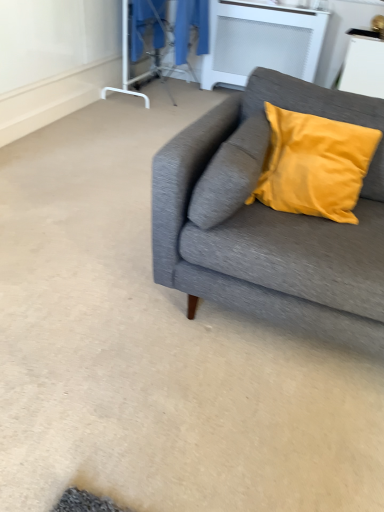
You are a GUI agent. You are given a task and a screenshot of the screen. Output one action in this format:
    pyautogui.click(x=<x>, y=<y>)
    Task: Click on the transparent plastic screen door at upper center
    The width and height of the screenshot is (384, 512).
    Given the screenshot: What is the action you would take?
    tap(143, 21)

Locate an element on the screen. white matte radiator at upper center, the 1th table from the back is located at coordinates (261, 42).

I want to click on textured gray couch at right, so click(x=274, y=224).

You are a GUI agent. You are given a task and a screenshot of the screen. Output one action in this format:
    pyautogui.click(x=<x>, y=<y>)
    Task: Click on the white glossy table at upper right, arranged as the 1th table when viewed from the front
    
    Given the screenshot: What is the action you would take?
    pyautogui.click(x=363, y=65)

I want to click on transparent plastic screen door at upper center, so 143,21.

Is transparent plastic screen door at upper center further to camera compared to textured gray couch at right?

Yes, it is behind textured gray couch at right.

Looking at their sizes, would you say transparent plastic screen door at upper center is wider or thinner than textured gray couch at right?

Considering their sizes, transparent plastic screen door at upper center looks slimmer than textured gray couch at right.

Could you tell me if transparent plastic screen door at upper center is turned towards textured gray couch at right?

No, transparent plastic screen door at upper center is not facing towards textured gray couch at right.

Does transparent plastic screen door at upper center have a greater height compared to textured gray couch at right?

No.

In the image, is white matte radiator at upper center, which is the 2th table from front to back, positioned in front of or behind transparent plastic screen door at upper center?

Clearly, white matte radiator at upper center, which is the 2th table from front to back, is behind transparent plastic screen door at upper center.

Locate an element on the screen. This screenshot has height=512, width=384. screen door located in front of the white matte radiator at upper center, which is the 2th table from front to back is located at coordinates (143, 21).

Visually, is white matte radiator at upper center, which appears as the second table when viewed from the right, positioned to the left or to the right of transparent plastic screen door at upper center?

Clearly, white matte radiator at upper center, which appears as the second table when viewed from the right, is on the right of transparent plastic screen door at upper center in the image.

Is white matte radiator at upper center, the 1th table from the back, taller than transparent plastic screen door at upper center?

Correct, white matte radiator at upper center, the 1th table from the back, is much taller as transparent plastic screen door at upper center.

Locate an element on the screen. The height and width of the screenshot is (512, 384). laundry on the left of white glossy table at upper right, positioned as the second table in left-to-right order is located at coordinates (189, 28).

From the image's perspective, which is above, white glossy table at upper right, positioned as the second table in left-to-right order, or blue fabric laundry at upper center?

From the image's view, blue fabric laundry at upper center is above.

Consider the image. Who is more distant, white glossy table at upper right, positioned as the second table in left-to-right order, or blue fabric laundry at upper center?

blue fabric laundry at upper center.

Could you measure the distance between white glossy table at upper right, positioned as the second table in left-to-right order, and blue fabric laundry at upper center?

1.42 meters.

From the image's perspective, is blue fabric laundry at upper center on top of transparent plastic screen door at upper center?

No, from the image's perspective, blue fabric laundry at upper center is not over transparent plastic screen door at upper center.

The width and height of the screenshot is (384, 512). I want to click on laundry on the right of transparent plastic screen door at upper center, so click(189, 28).

How much distance is there between blue fabric laundry at upper center and transparent plastic screen door at upper center?

blue fabric laundry at upper center is 25.71 inches away from transparent plastic screen door at upper center.

Is point (180, 23) positioned before point (127, 8)?

Yes, it is.

Considering the points (309, 309) and (149, 2), which point is in front, point (309, 309) or point (149, 2)?

The point (309, 309) is more forward.

Are textured gray couch at right and transparent plastic screen door at upper center beside each other?

No, textured gray couch at right is not next to transparent plastic screen door at upper center.

Is textured gray couch at right located outside transparent plastic screen door at upper center?

Yes, textured gray couch at right is not within transparent plastic screen door at upper center.

Is white glossy table at upper right, positioned as the second table in left-to-right order, at the back of textured gray couch at right?

Yes, textured gray couch at right is positioned with its back facing white glossy table at upper right, positioned as the second table in left-to-right order.

From the image's perspective, between textured gray couch at right and white glossy table at upper right, positioned as the second table in left-to-right order, who is located below?

textured gray couch at right is shown below in the image.

Considering the relative sizes of textured gray couch at right and white glossy table at upper right, arranged as the 1th table when viewed from the front, in the image provided, is textured gray couch at right bigger than white glossy table at upper right, arranged as the 1th table when viewed from the front,?

Yes, textured gray couch at right is bigger than white glossy table at upper right, arranged as the 1th table when viewed from the front.

Is the surface of textured gray couch at right in direct contact with white glossy table at upper right, which appears as the 2th table when viewed from the back?

No, textured gray couch at right is not with white glossy table at upper right, which appears as the 2th table when viewed from the back.

You are a GUI agent. You are given a task and a screenshot of the screen. Output one action in this format:
    pyautogui.click(x=<x>, y=<y>)
    Task: Click on the table on the right side of white matte radiator at upper center, which is the 2th table from front to back
    
    Given the screenshot: What is the action you would take?
    pyautogui.click(x=363, y=65)

Considering the relative positions of white matte radiator at upper center, which is the 2th table from front to back, and white glossy table at upper right, arranged as the 1th table when viewed from the front, in the image provided, is white matte radiator at upper center, which is the 2th table from front to back, in front of white glossy table at upper right, arranged as the 1th table when viewed from the front,?

No.

Considering the positions of point (305, 28) and point (344, 63), is point (305, 28) closer or farther from the camera than point (344, 63)?

Point (305, 28) appears to be farther away from the viewer than point (344, 63).

Which object is wider, white matte radiator at upper center, which is counted as the 1th table, starting from the left, or white glossy table at upper right, positioned as the second table in left-to-right order?

white glossy table at upper right, positioned as the second table in left-to-right order.

Where is `screen door lying on the left of textured gray couch at right`? This screenshot has width=384, height=512. screen door lying on the left of textured gray couch at right is located at coordinates (143, 21).

Find the location of a particular element. The image size is (384, 512). screen door above the white matte radiator at upper center, which is the 2th table from front to back (from the image's perspective) is located at coordinates (143, 21).

Looking at the image, which one is located closer to white glossy table at upper right, which appears as the 2th table when viewed from the back, white matte radiator at upper center, which is counted as the 1th table, starting from the left, or transparent plastic screen door at upper center?

Among the two, white matte radiator at upper center, which is counted as the 1th table, starting from the left, is located nearer to white glossy table at upper right, which appears as the 2th table when viewed from the back.

Based on their spatial positions, is textured gray couch at right or white matte radiator at upper center, which is the 2th table from front to back, further from blue fabric laundry at upper center?

textured gray couch at right lies further to blue fabric laundry at upper center than the other object.

When comparing their distances from white matte radiator at upper center, which is counted as the 1th table, starting from the left, does blue fabric laundry at upper center or white glossy table at upper right, which appears as the 2th table when viewed from the back, seem closer?

blue fabric laundry at upper center is closer to white matte radiator at upper center, which is counted as the 1th table, starting from the left.

When comparing their distances from white glossy table at upper right, arranged as the 1th table when viewed from the front, does transparent plastic screen door at upper center or white matte radiator at upper center, which is counted as the 1th table, starting from the left, seem closer?

white matte radiator at upper center, which is counted as the 1th table, starting from the left.

Considering their positions, is transparent plastic screen door at upper center positioned further to blue fabric laundry at upper center than textured gray couch at right?

textured gray couch at right is further to blue fabric laundry at upper center.

Looking at the image, which one is located closer to textured gray couch at right, transparent plastic screen door at upper center or white glossy table at upper right, arranged as the first table when viewed from the right?

Based on the image, white glossy table at upper right, arranged as the first table when viewed from the right, appears to be nearer to textured gray couch at right.

From the image, which object appears to be farther from white matte radiator at upper center, which is counted as the 1th table, starting from the left, white glossy table at upper right, which appears as the 2th table when viewed from the back, or transparent plastic screen door at upper center?

transparent plastic screen door at upper center is further to white matte radiator at upper center, which is counted as the 1th table, starting from the left.

Based on their spatial positions, is white glossy table at upper right, positioned as the second table in left-to-right order, or textured gray couch at right closer to white matte radiator at upper center, the 1th table from the back?

white glossy table at upper right, positioned as the second table in left-to-right order, is closer to white matte radiator at upper center, the 1th table from the back.

Find the location of `table positioned between textured gray couch at right and white matte radiator at upper center, which appears as the second table when viewed from the right, from near to far`. table positioned between textured gray couch at right and white matte radiator at upper center, which appears as the second table when viewed from the right, from near to far is located at coordinates (363, 65).

Where is `laundry between textured gray couch at right and white matte radiator at upper center, which appears as the second table when viewed from the right, from front to back`? Image resolution: width=384 pixels, height=512 pixels. laundry between textured gray couch at right and white matte radiator at upper center, which appears as the second table when viewed from the right, from front to back is located at coordinates (189, 28).

I want to click on table between transparent plastic screen door at upper center and white glossy table at upper right, arranged as the 1th table when viewed from the front, from left to right, so (x=261, y=42).

I want to click on laundry situated between transparent plastic screen door at upper center and white matte radiator at upper center, the 1th table from the back, from left to right, so click(189, 28).